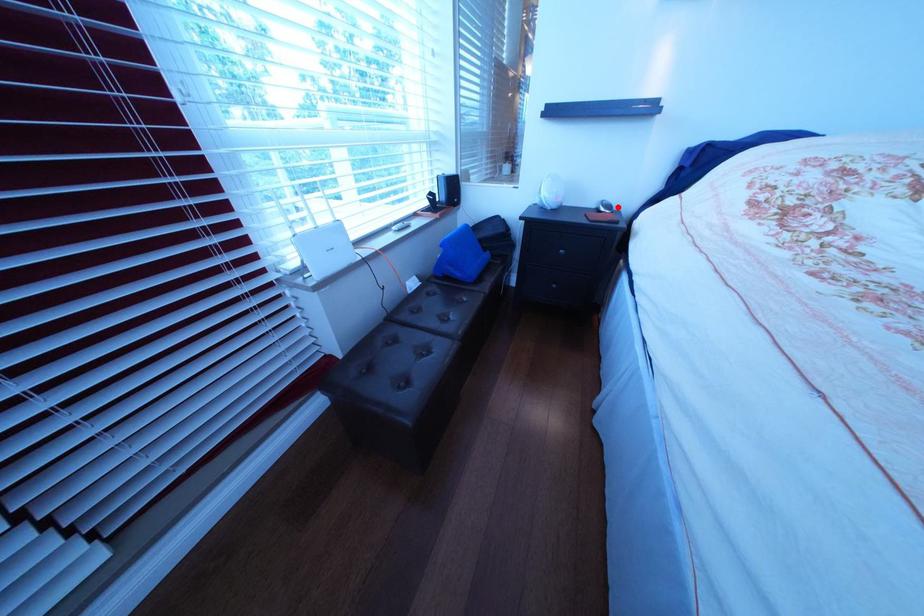
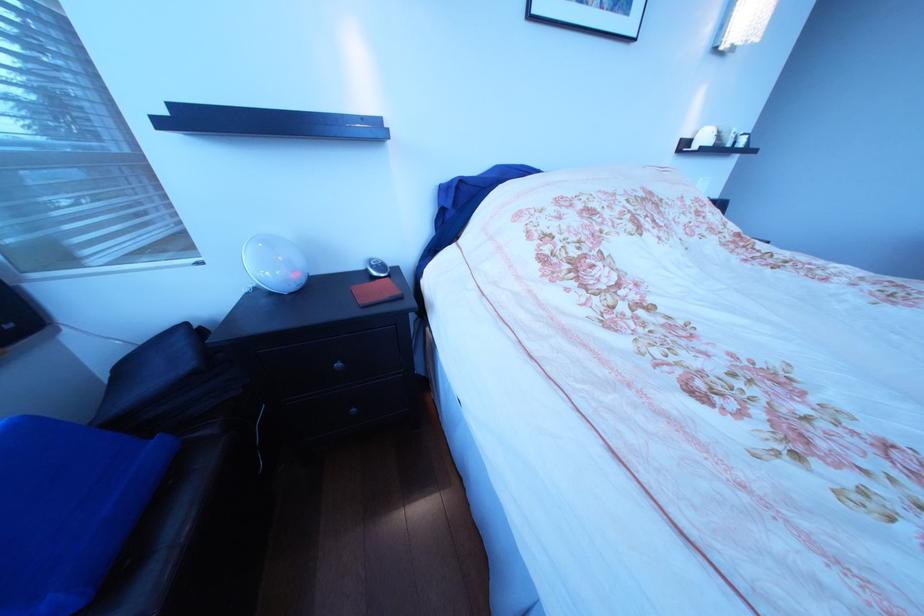
Find the pixel in the second image that matches the highlighted location in the first image.

(387, 268)